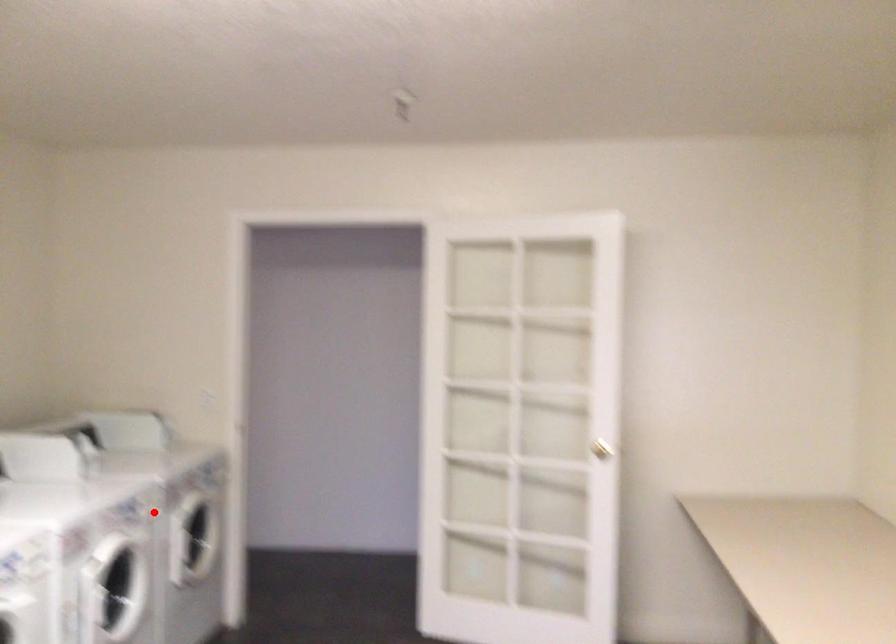
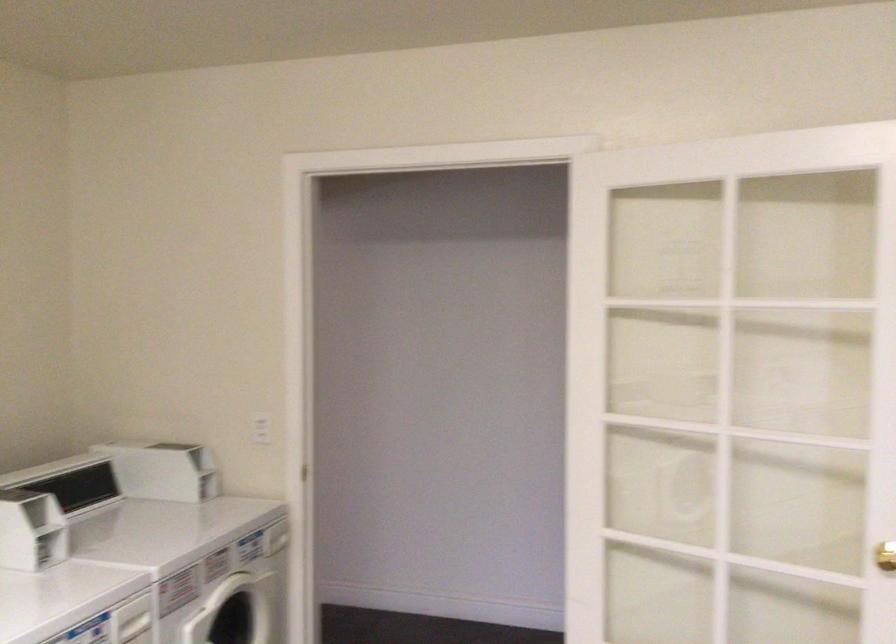
Question: A red point is marked in image1. In image2, is the corresponding 3D point closer to the camera or farther? Reply with the corresponding letter.

Choices:
 (A) The corresponding 3D point is closer.
 (B) The corresponding 3D point is farther.

Answer: (A)